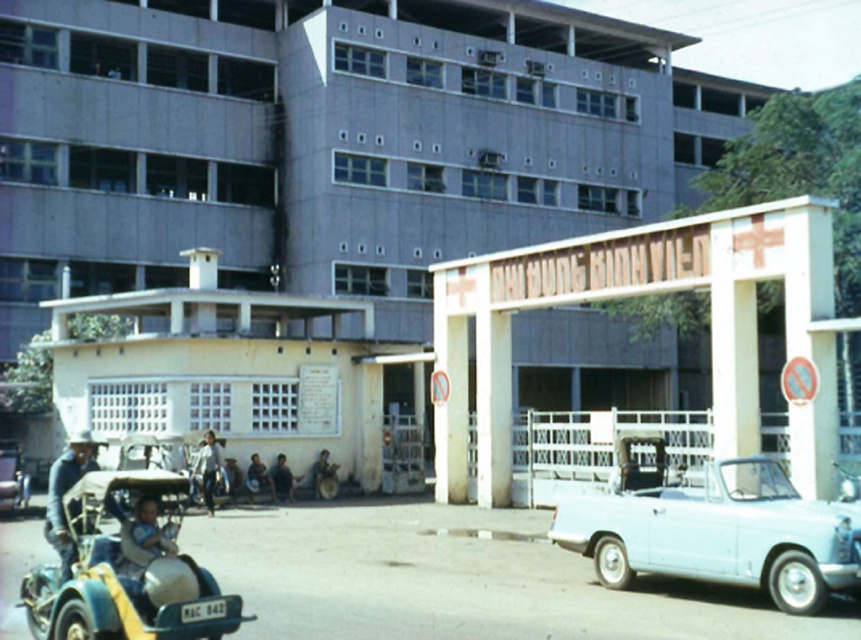
At what (x,y) coordinates should I click in order to perform the action: click on blue denim jacket at left. Please return your answer as a coordinate pair (x, y). Looking at the image, I should click on (64, 492).

In the scene shown: Between blue denim jacket at left and light blue fabric baby carriage at lower left, which one has more height?

blue denim jacket at left

Find the location of `blue denim jacket at left`. blue denim jacket at left is located at coordinates (64, 492).

Who is higher up, light blue fabric baby carriage at lower left or light brown leather jacket at center?

light blue fabric baby carriage at lower left

Who is positioned more to the right, light blue fabric baby carriage at lower left or light brown leather jacket at center?

From the viewer's perspective, light blue fabric baby carriage at lower left appears more on the right side.

Describe the element at coordinates (143, 540) in the screenshot. This screenshot has height=640, width=861. I see `light blue fabric baby carriage at lower left` at that location.

At what (x,y) coordinates should I click in order to perform the action: click on light blue fabric baby carriage at lower left. Please return your answer as a coordinate pair (x, y). Image resolution: width=861 pixels, height=640 pixels. Looking at the image, I should click on (143, 540).

Is metallic green car at lower left below light brown leather jacket at center?

No, metallic green car at lower left is not below light brown leather jacket at center.

Which is behind, point (5, 461) or point (214, 465)?

The point (214, 465) is more distant.

Is point (20, 490) less distant than point (209, 490)?

Yes, it is.

You are a GUI agent. You are given a task and a screenshot of the screen. Output one action in this format:
    pyautogui.click(x=<x>, y=<y>)
    Task: Click on the metallic green car at lower left
    This screenshot has width=861, height=640.
    Given the screenshot: What is the action you would take?
    pyautogui.click(x=11, y=480)